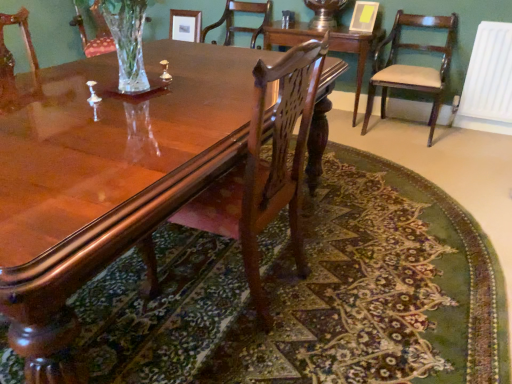
Question: From the image's perspective, does white plastic radiator at right appear lower than mahogany wood table at center?

Choices:
 (A) no
 (B) yes

Answer: (B)

Question: From a real-world perspective, does white plastic radiator at right stand above mahogany wood table at center?

Choices:
 (A) yes
 (B) no

Answer: (A)

Question: Can you confirm if white plastic radiator at right is wider than mahogany wood table at center?

Choices:
 (A) no
 (B) yes

Answer: (A)

Question: Is white plastic radiator at right not within mahogany wood table at center?

Choices:
 (A) yes
 (B) no

Answer: (A)

Question: Does white plastic radiator at right have a smaller size compared to mahogany wood table at center?

Choices:
 (A) yes
 (B) no

Answer: (A)

Question: Considering the relative sizes of white plastic radiator at right and mahogany wood table at center in the image provided, is white plastic radiator at right thinner than mahogany wood table at center?

Choices:
 (A) yes
 (B) no

Answer: (A)

Question: From the image's perspective, is white plastic radiator at right above polished wood chair at center, which appears as the 3th chair when viewed from the back?

Choices:
 (A) yes
 (B) no

Answer: (A)

Question: Would you say white plastic radiator at right contains polished wood chair at center, the second chair when ordered from right to left?

Choices:
 (A) yes
 (B) no

Answer: (B)

Question: Is white plastic radiator at right not within polished wood chair at center, placed as the first chair when sorted from front to back?

Choices:
 (A) no
 (B) yes

Answer: (B)

Question: From a real-world perspective, is white plastic radiator at right on polished wood chair at center, which ranks as the second chair in left-to-right order?

Choices:
 (A) yes
 (B) no

Answer: (B)

Question: Is white plastic radiator at right oriented towards polished wood chair at center, which ranks as the second chair in left-to-right order?

Choices:
 (A) no
 (B) yes

Answer: (B)

Question: Considering the relative sizes of white plastic radiator at right and polished wood chair at center, the second chair when ordered from right to left, in the image provided, is white plastic radiator at right shorter than polished wood chair at center, the second chair when ordered from right to left,?

Choices:
 (A) no
 (B) yes

Answer: (B)

Question: Is white plastic radiator at right at the right side of glossy wood coffee table at center?

Choices:
 (A) yes
 (B) no

Answer: (A)